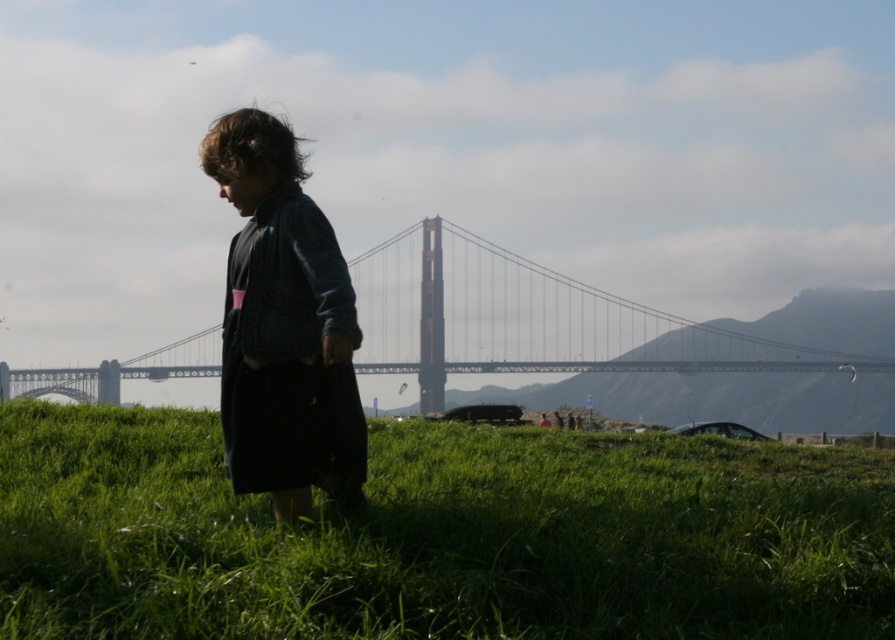
You are a photographer trying to capture the Golden Gate Bridge in the background. You want to place a small flag on the green grassy field at lower center. Where exactly should you place it?

Place the small flag at the coordinates point (439, 536) on the green grassy field at lower center.

You are standing at the point labeled as point (439,536) in the image. What can you see directly in front of you?

You can see the green grassy field at lower center directly in front of you.